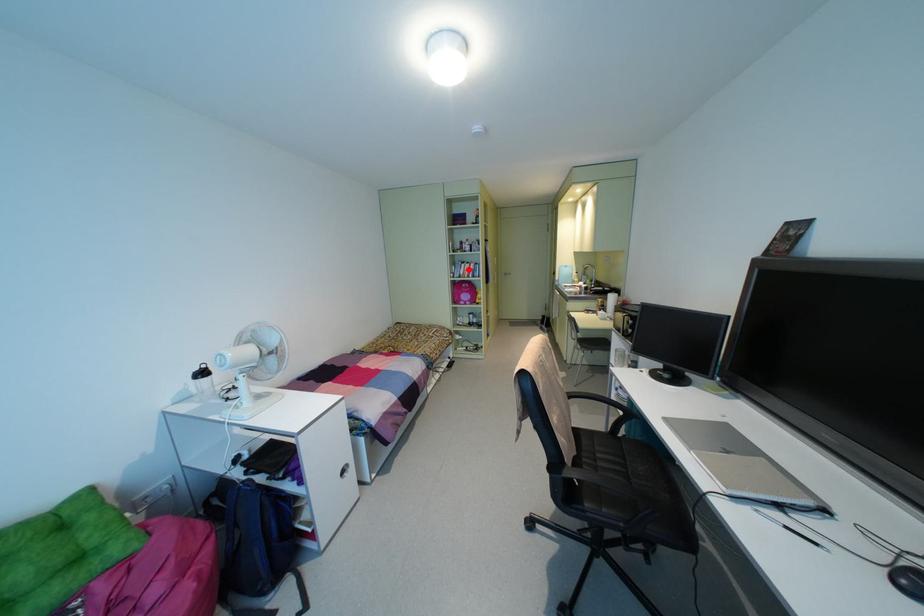
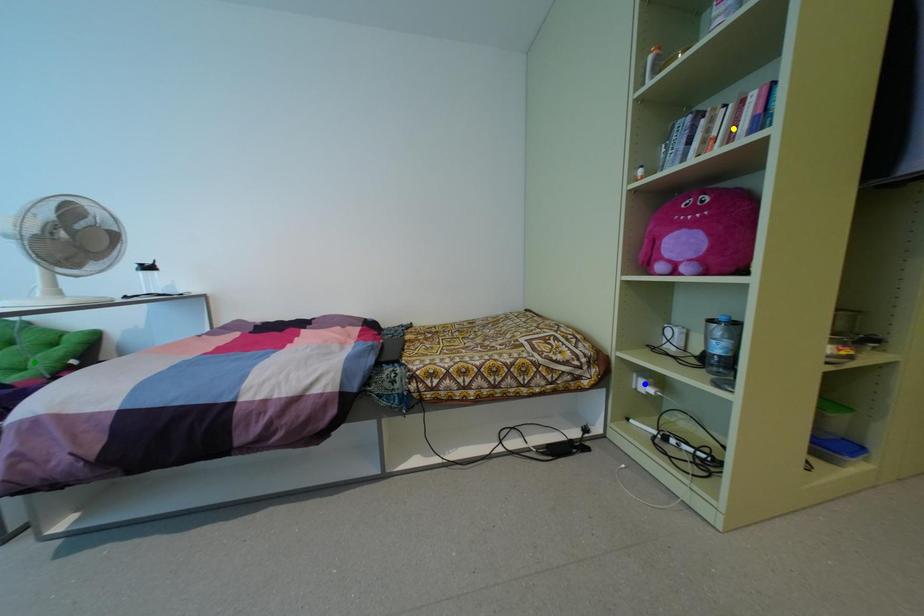
Question: I am providing you with two images of the same scene from different viewpoints. A red point is marked on the first image. You are given multiple points on the second image. Which point in image 2 is actually the same real-world point as the red point in image 1?

Choices:
 (A) green point
 (B) blue point
 (C) yellow point

Answer: (C)